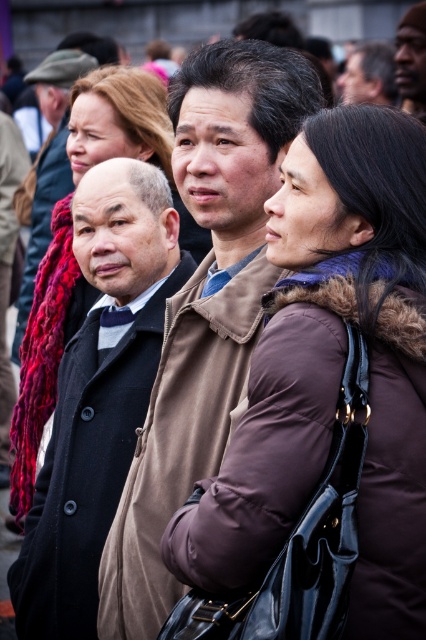
Question: Observing the image, what is the correct spatial positioning of dark brown wool coat at center in reference to red knitted scarf at left?

Choices:
 (A) above
 (B) below

Answer: (B)

Question: Which object is the closest to the purple fuzzy scarf at center?

Choices:
 (A) dark brown wool coat at center
 (B) brown fuzzy coat at center

Answer: (B)

Question: Is purple fuzzy scarf at center positioned in front of matte brown hair at upper right?

Choices:
 (A) yes
 (B) no

Answer: (A)

Question: Which point is farther from the camera taking this photo?

Choices:
 (A) (416, 77)
 (B) (307, 563)
 (C) (141, 397)

Answer: (A)

Question: Is purple fuzzy scarf at center closer to the viewer compared to red knitted scarf at left?

Choices:
 (A) no
 (B) yes

Answer: (B)

Question: Among these objects, which one is nearest to the camera?

Choices:
 (A) knitted wool scarf at upper left
 (B) brown matte jacket at center
 (C) matte brown hair at upper right
 (D) brown fuzzy coat at center

Answer: (D)